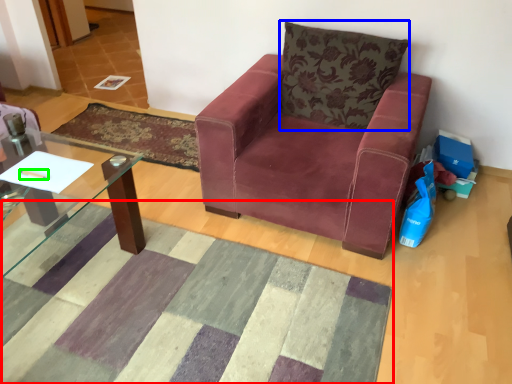
Question: Which is farther away from mat (highlighted by a red box)? pillow (highlighted by a blue box) or pen (highlighted by a green box)?

Choices:
 (A) pillow
 (B) pen

Answer: (A)